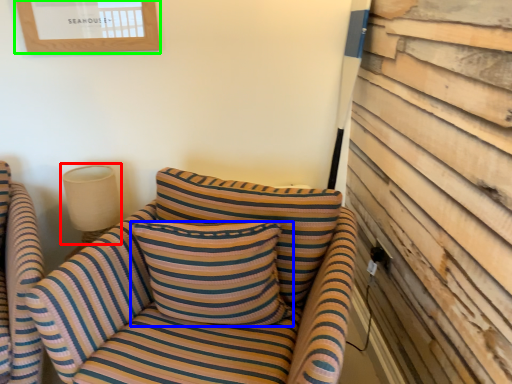
Question: Which object is the farthest from lamp (highlighted by a red box)? Choose among these: pillow (highlighted by a blue box) or picture frame (highlighted by a green box).

Choices:
 (A) pillow
 (B) picture frame

Answer: (B)